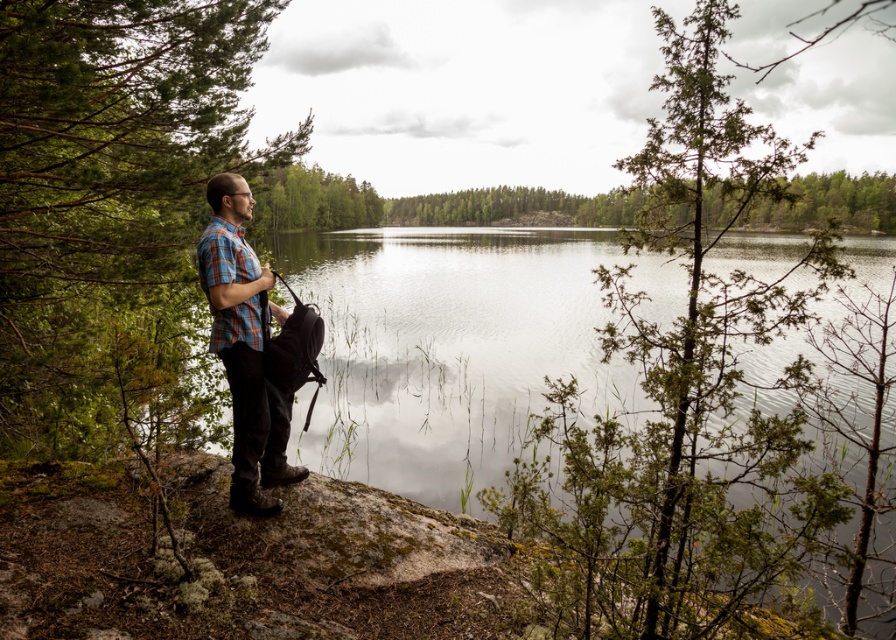
Question: Is clear water at center bigger than plaid fabric shirt at center?

Choices:
 (A) no
 (B) yes

Answer: (B)

Question: Can you confirm if clear water at center is smaller than plaid fabric shirt at center?

Choices:
 (A) no
 (B) yes

Answer: (A)

Question: Can you confirm if clear water at center is positioned below plaid fabric shirt at center?

Choices:
 (A) no
 (B) yes

Answer: (A)